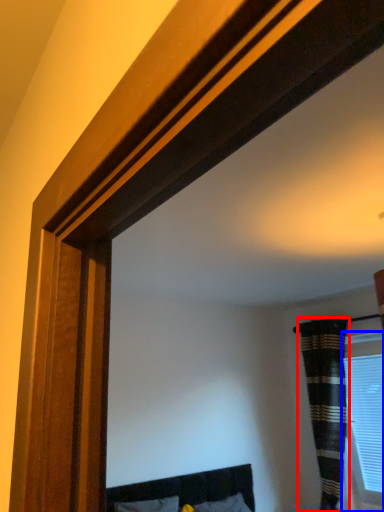
Question: Among these objects, which one is farthest to the camera, curtain (highlighted by a red box) or window (highlighted by a blue box)?

Choices:
 (A) curtain
 (B) window

Answer: (B)